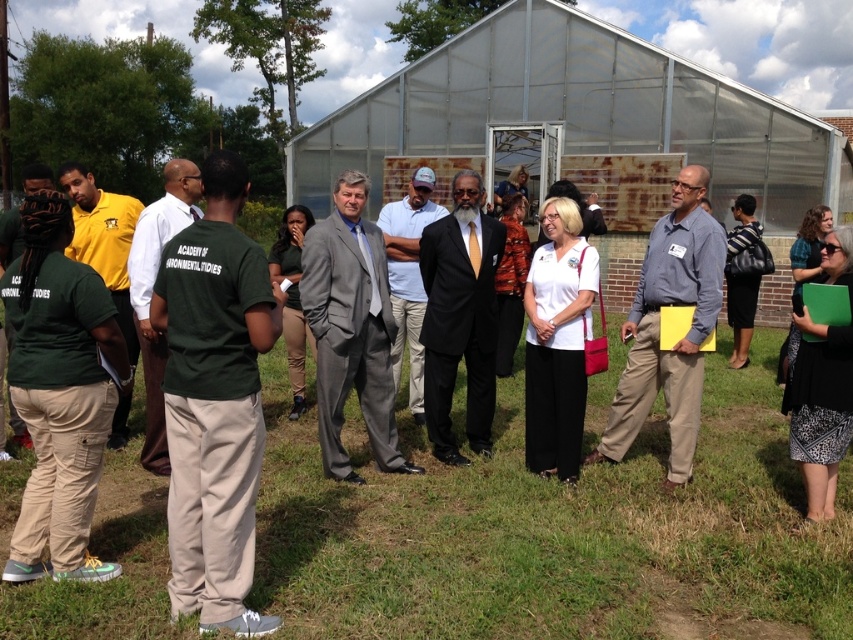
Is green uniform at center further to the viewer compared to matte yellow shirt at left?

No, it is in front of matte yellow shirt at left.

What are the coordinates of `green uniform at center` in the screenshot? It's located at (151, 292).

Where is `green uniform at center`? green uniform at center is located at coordinates pyautogui.click(x=151, y=292).

I want to click on green uniform at center, so click(151, 292).

Identify the location of green cotton shirt at center. The height and width of the screenshot is (640, 853). (213, 401).

Is green cotton shirt at center positioned before matte yellow shirt at left?

Yes, it is.

Measure the distance between green cotton shirt at center and camera.

green cotton shirt at center is 3.07 meters away from camera.

Where is `green cotton shirt at center`? The image size is (853, 640). green cotton shirt at center is located at coordinates (213, 401).

Is gray fabric shirt at center taller than matte yellow shirt at left?

Indeed, gray fabric shirt at center has a greater height compared to matte yellow shirt at left.

Is point (701, 246) closer to camera compared to point (126, 301)?

Yes, point (701, 246) is in front of point (126, 301).

Is point (651, 310) farther from viewer compared to point (126, 310)?

No, (651, 310) is closer to viewer.

Find the location of a particular element. gray fabric shirt at center is located at coordinates (659, 328).